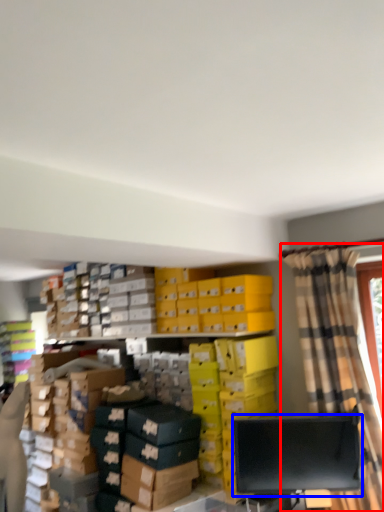
Question: Which object is closer to the camera taking this photo, curtain (highlighted by a red box) or computer monitor (highlighted by a blue box)?

Choices:
 (A) curtain
 (B) computer monitor

Answer: (A)